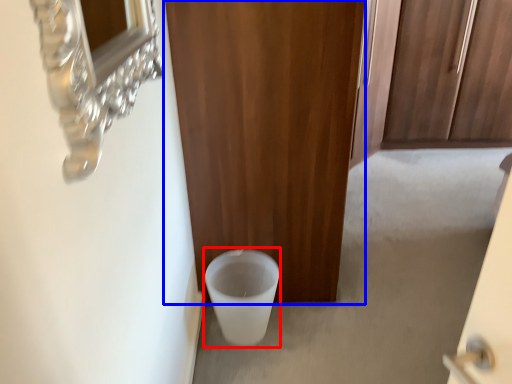
Question: Among these objects, which one is nearest to the camera, toilet bowl (highlighted by a red box) or door (highlighted by a blue box)?

Choices:
 (A) toilet bowl
 (B) door

Answer: (B)